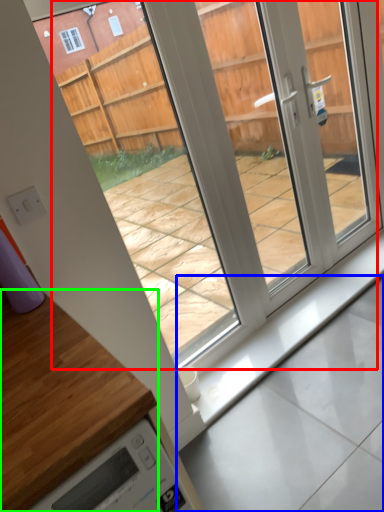
Question: Which object is the farthest from glass door (highlighted by a red box)? Choose among these: concrete (highlighted by a blue box) or countertop (highlighted by a green box).

Choices:
 (A) concrete
 (B) countertop

Answer: (B)